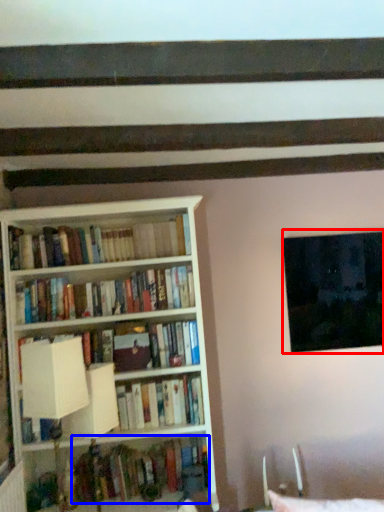
Question: Which object appears farthest to the camera in this image, window (highlighted by a red box) or book (highlighted by a blue box)?

Choices:
 (A) window
 (B) book

Answer: (A)